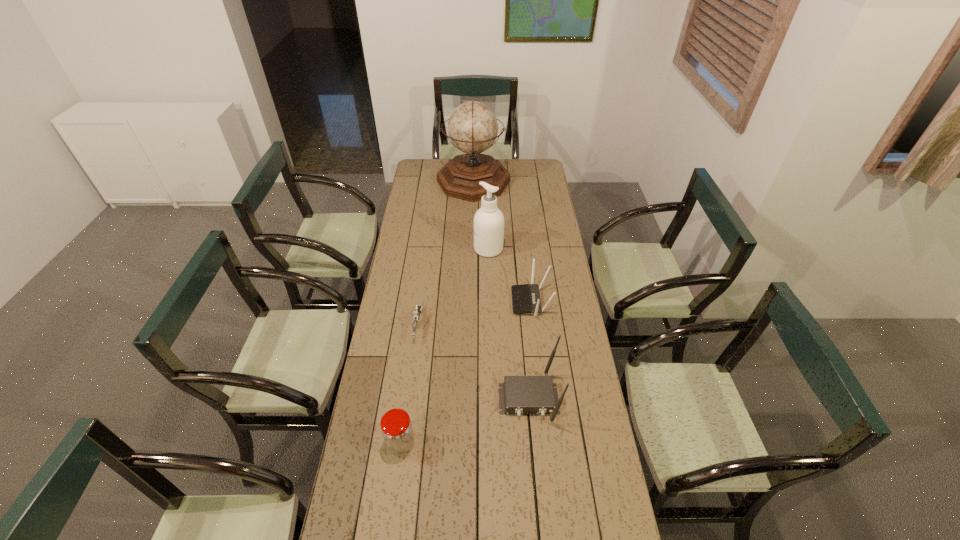
Identify the location of free space between the farther router and the fourth shortest object. The width and height of the screenshot is (960, 540). (530, 350).

Locate an element on the screen. This screenshot has height=540, width=960. free area in between the gun and the globe is located at coordinates (445, 254).

Locate an element on the screen. This screenshot has width=960, height=540. unoccupied position between the jar and the gun is located at coordinates (409, 384).

Locate an element on the screen. The height and width of the screenshot is (540, 960). empty space between the nearer router and the nearest object is located at coordinates (465, 421).

Locate which object is the second closest to the shortest object. Please provide its 2D coordinates. Your answer should be formatted as a tuple, i.e. [(x, y)], where the tuple contains the x and y coordinates of a point satisfying the conditions above.

[(397, 431)]

You are a GUI agent. You are given a task and a screenshot of the screen. Output one action in this format:
    pyautogui.click(x=<x>, y=<y>)
    Task: Click on the object that can be found as the second closest to the fifth shortest object
    
    Given the screenshot: What is the action you would take?
    pyautogui.click(x=472, y=127)

Where is `free region that satisfies the following two spatial constraints: 1. on the front label of the fifth shortest object; 2. aimed along the barrel of the shortest object`? This screenshot has height=540, width=960. free region that satisfies the following two spatial constraints: 1. on the front label of the fifth shortest object; 2. aimed along the barrel of the shortest object is located at coordinates (491, 326).

The width and height of the screenshot is (960, 540). Identify the location of free point that satisfies the following two spatial constraints: 1. on the surface of the tallest object; 2. aimed along the barrel of the gun. (470, 326).

Where is `free space that satisfies the following two spatial constraints: 1. on the front label of the second farthest object; 2. on the front side of the jar`? The height and width of the screenshot is (540, 960). free space that satisfies the following two spatial constraints: 1. on the front label of the second farthest object; 2. on the front side of the jar is located at coordinates (492, 443).